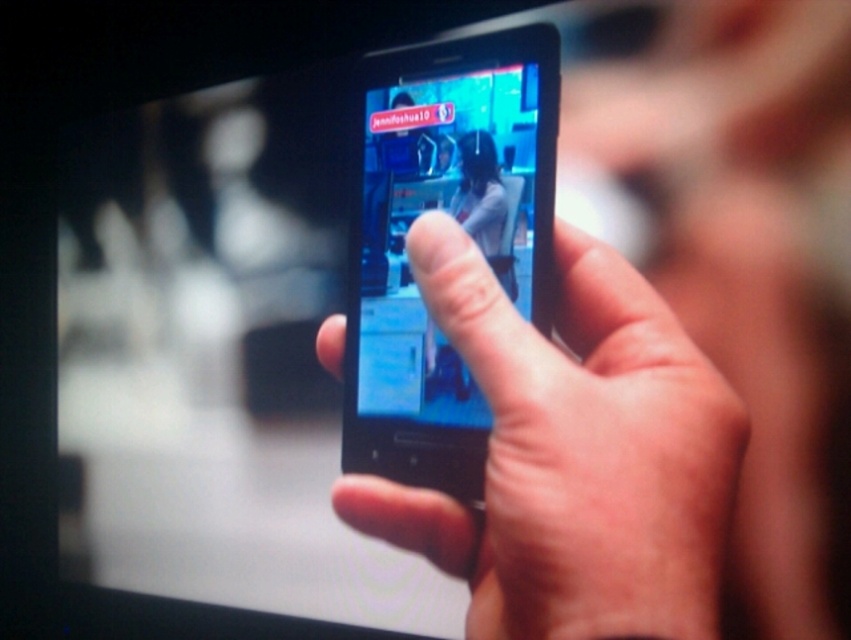
Question: Among these points, which one is nearest to the camera?

Choices:
 (A) (583, 513)
 (B) (460, 196)

Answer: (A)

Question: Does matte black phone at center have a greater width compared to shiny blue phone at center?

Choices:
 (A) no
 (B) yes

Answer: (B)

Question: Does matte black phone at center appear on the right side of shiny blue phone at center?

Choices:
 (A) yes
 (B) no

Answer: (A)

Question: Which of the following is the farthest from the observer?

Choices:
 (A) (718, 576)
 (B) (486, 420)

Answer: (B)

Question: Is matte black phone at center bigger than shiny blue phone at center?

Choices:
 (A) yes
 (B) no

Answer: (A)

Question: Which point appears farthest from the camera in this image?

Choices:
 (A) [x=465, y=419]
 (B) [x=647, y=292]

Answer: (B)